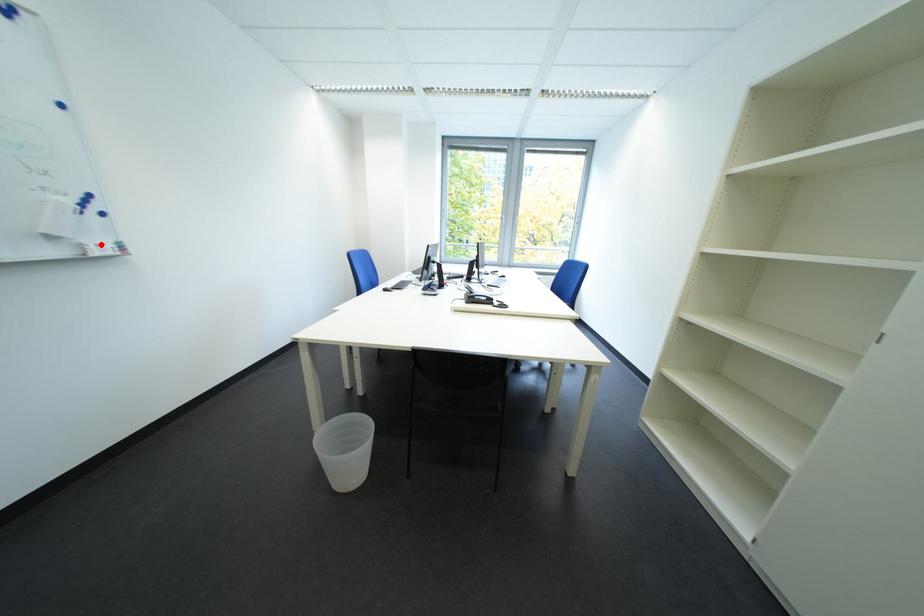
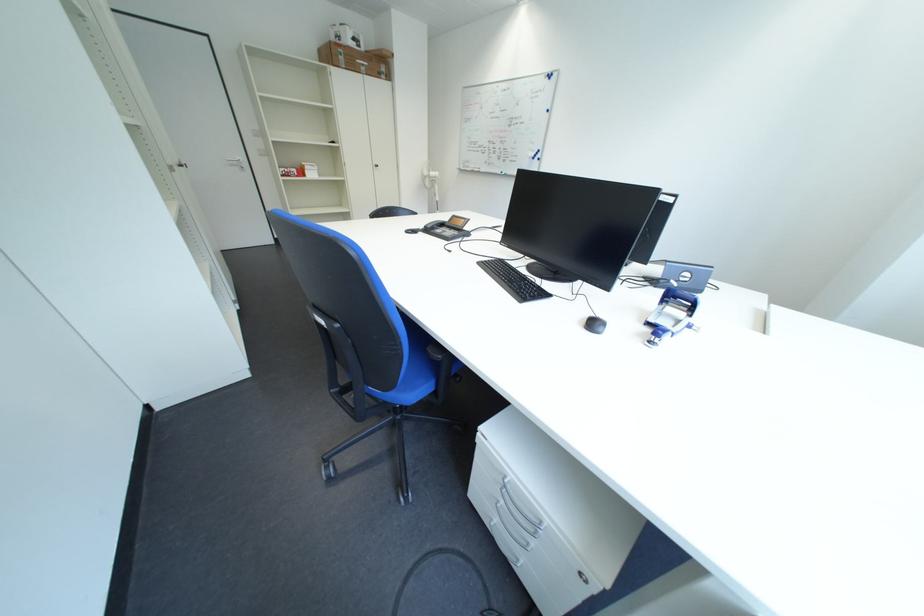
Question: I am providing you with two images of the same scene from different viewpoints. A red point is marked on the first image. Is the red point's position out of view in image 2?

Choices:
 (A) Yes
 (B) No

Answer: (A)